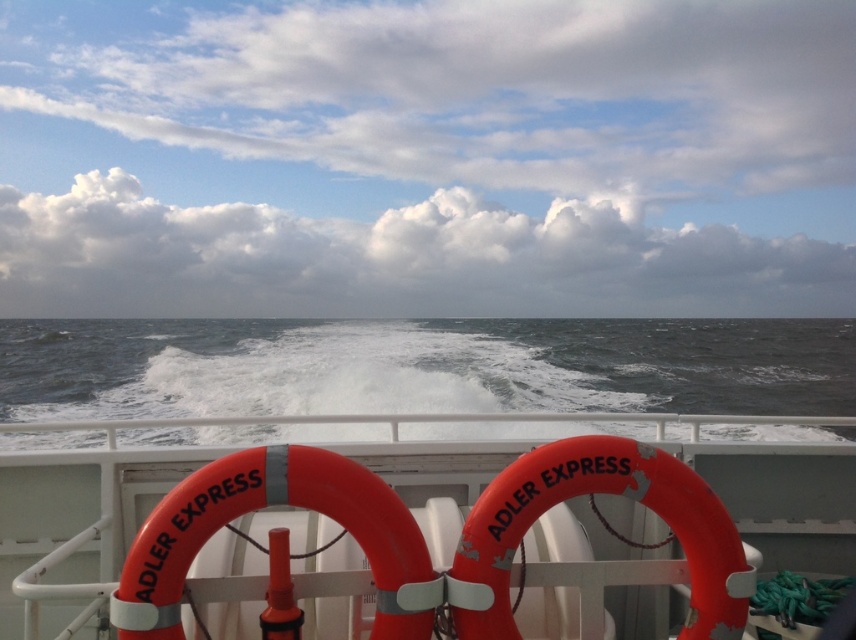
Can you confirm if orange rubber lifebuoy at center is wider than dark gray water at center?

In fact, orange rubber lifebuoy at center might be narrower than dark gray water at center.

Can you confirm if orange rubber lifebuoy at center is taller than dark gray water at center?

Incorrect, orange rubber lifebuoy at center's height is not larger of dark gray water at center's.

Does point (542, 532) come in front of point (777, 396)?

Yes, point (542, 532) is closer to viewer.

Locate an element on the screen. This screenshot has height=640, width=856. orange rubber lifebuoy at center is located at coordinates (395, 532).

Between orange rubber lifebuoy at center and orange rubber life ring at center, which one is positioned lower?

Positioned lower is orange rubber lifebuoy at center.

Who is taller, orange rubber lifebuoy at center or orange rubber life ring at center?

orange rubber lifebuoy at center

Who is more distant from viewer, [97,611] or [144,616]?

The point [97,611] is more distant.

This screenshot has width=856, height=640. I want to click on orange rubber lifebuoy at center, so click(395, 532).

Can you confirm if dark gray water at center is thinner than orange rubber life ring at center?

No.

Is dark gray water at center above orange rubber life ring at center?

Indeed, dark gray water at center is positioned over orange rubber life ring at center.

Where is `dark gray water at center`? Image resolution: width=856 pixels, height=640 pixels. dark gray water at center is located at coordinates (423, 365).